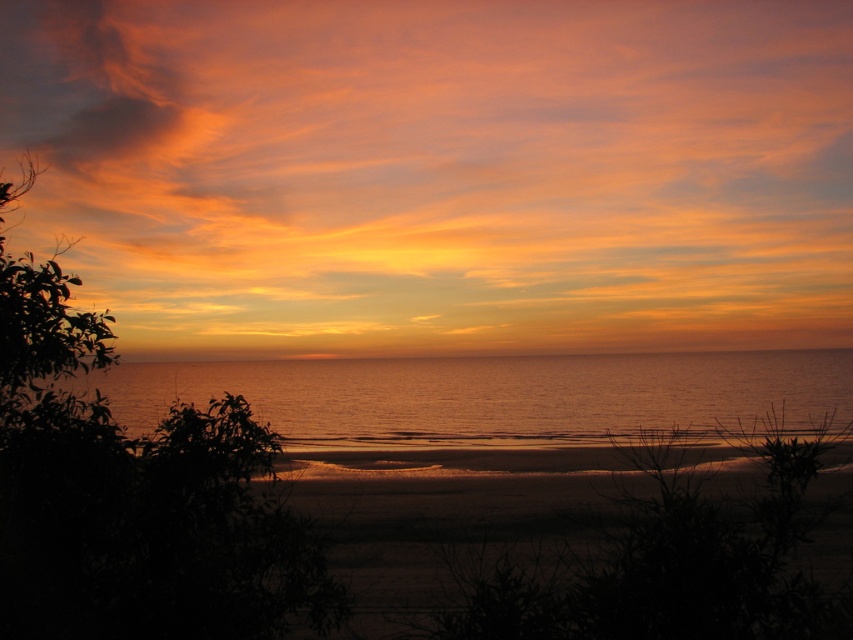
Question: Which of the following is the closest to the observer?

Choices:
 (A) (300, 164)
 (B) (527, 420)

Answer: (B)

Question: Is matte orange cloud at upper center above silvery water at center?

Choices:
 (A) yes
 (B) no

Answer: (A)

Question: Considering the relative positions of matte orange cloud at upper center and silvery water at center in the image provided, where is matte orange cloud at upper center located with respect to silvery water at center?

Choices:
 (A) left
 (B) right

Answer: (B)

Question: Is matte orange cloud at upper center positioned behind silvery water at center?

Choices:
 (A) yes
 (B) no

Answer: (B)